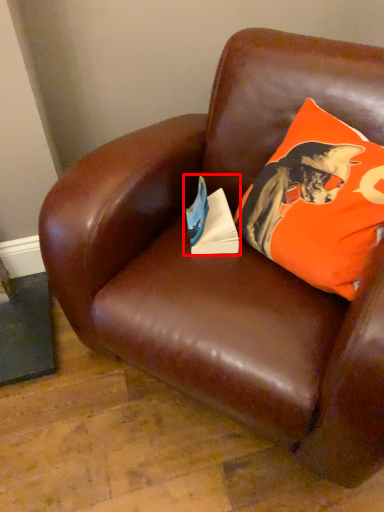
Question: Considering the relative positions of paperback book (annotated by the red box) and pillow in the image provided, where is paperback book (annotated by the red box) located with respect to the staircase?

Choices:
 (A) right
 (B) left

Answer: (B)